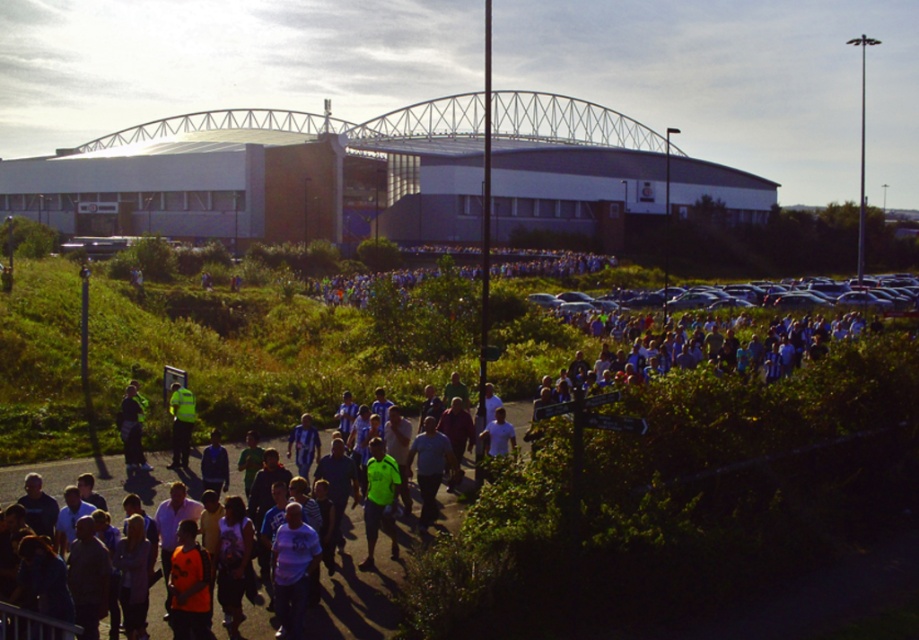
Question: Which point is closer to the camera?

Choices:
 (A) (563, 122)
 (B) (903, 408)

Answer: (B)

Question: Which point is farther to the camera?

Choices:
 (A) neon green jersey at center
 (B) high visibility jacket at center
 (C) blue striped shirts at center
 (D) green jersey at center

Answer: (B)

Question: Can you confirm if blue striped shirts at center is thinner than gray metallic stadium at upper center?

Choices:
 (A) yes
 (B) no

Answer: (A)

Question: Observing the image, what is the correct spatial positioning of gray metallic stadium at upper center in reference to high visibility jacket at center?

Choices:
 (A) right
 (B) left

Answer: (B)

Question: Which is nearer to the neon green jersey at center?

Choices:
 (A) high visibility jacket at center
 (B) gray metallic stadium at upper center
 (C) blue striped shirts at center
 (D) green jersey at center

Answer: (C)

Question: In this image, where is blue striped shirts at center located relative to neon green jersey at center?

Choices:
 (A) above
 (B) below

Answer: (A)